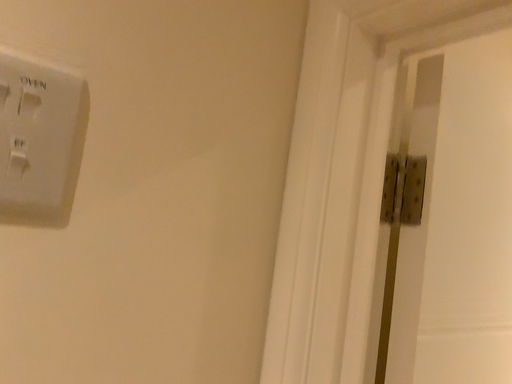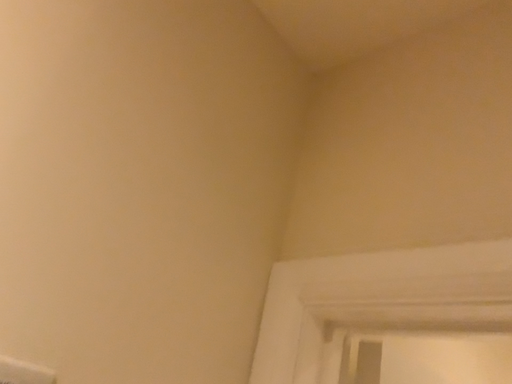
Question: Which way did the camera rotate in the video?

Choices:
 (A) rotated left
 (B) rotated right

Answer: (B)